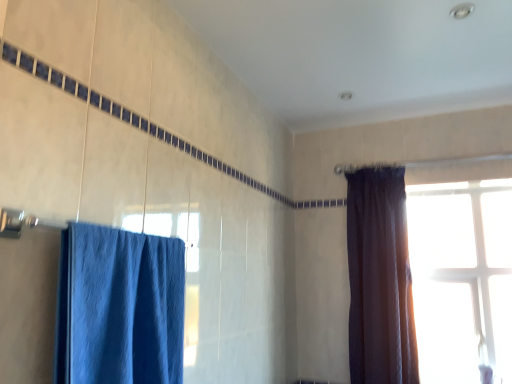
Question: Is blue fabric curtain at left, the first curtain viewed from the left, bigger than transparent glass window at upper right?

Choices:
 (A) yes
 (B) no

Answer: (A)

Question: From the image's perspective, is blue fabric curtain at left, which ranks as the 2th curtain in back-to-front order, located beneath transparent glass window at upper right?

Choices:
 (A) yes
 (B) no

Answer: (B)

Question: From the image's perspective, is blue fabric curtain at left, the 1th curtain from the front, located above transparent glass window at upper right?

Choices:
 (A) no
 (B) yes

Answer: (B)

Question: Does blue fabric curtain at left, the 1th curtain from the front, appear on the left side of transparent glass window at upper right?

Choices:
 (A) no
 (B) yes

Answer: (B)

Question: Is blue fabric curtain at left, which appears as the second curtain when viewed from the right, completely or partially outside of transparent glass window at upper right?

Choices:
 (A) no
 (B) yes

Answer: (B)

Question: Considering the relative positions of blue fabric curtain at left, the 1th curtain from the front, and transparent glass window at upper right in the image provided, is blue fabric curtain at left, the 1th curtain from the front, in front of transparent glass window at upper right?

Choices:
 (A) yes
 (B) no

Answer: (A)

Question: Is the depth of transparent glass window at upper right greater than that of blue fabric curtain at left, the first curtain viewed from the left?

Choices:
 (A) no
 (B) yes

Answer: (B)

Question: Is transparent glass window at upper right not close to blue fabric curtain at left, the 1th curtain from the front?

Choices:
 (A) no
 (B) yes

Answer: (B)

Question: Could you tell me if transparent glass window at upper right is facing blue fabric curtain at left, the first curtain viewed from the left?

Choices:
 (A) yes
 (B) no

Answer: (B)

Question: Is transparent glass window at upper right bigger than blue fabric curtain at left, which appears as the second curtain when viewed from the right?

Choices:
 (A) no
 (B) yes

Answer: (A)

Question: From a real-world perspective, is transparent glass window at upper right located higher than blue fabric curtain at left, the first curtain viewed from the left?

Choices:
 (A) no
 (B) yes

Answer: (B)

Question: Does transparent glass window at upper right appear on the right side of blue fabric curtain at left, which ranks as the 2th curtain in back-to-front order?

Choices:
 (A) yes
 (B) no

Answer: (A)

Question: Can you confirm if dark velvet curtain at right, the second curtain in the front-to-back sequence, is taller than blue fabric curtain at left, which appears as the second curtain when viewed from the right?

Choices:
 (A) yes
 (B) no

Answer: (A)